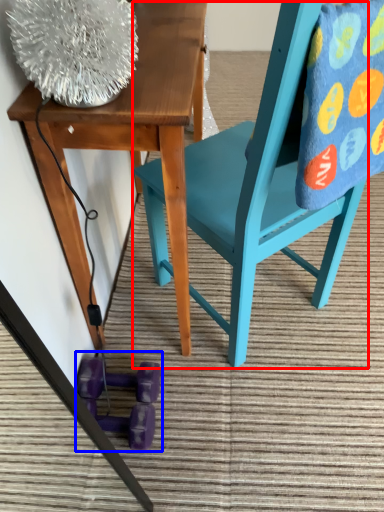
Question: Which point is closer to the camera, chair (highlighted by a red box) or toy (highlighted by a blue box)?

Choices:
 (A) chair
 (B) toy

Answer: (A)